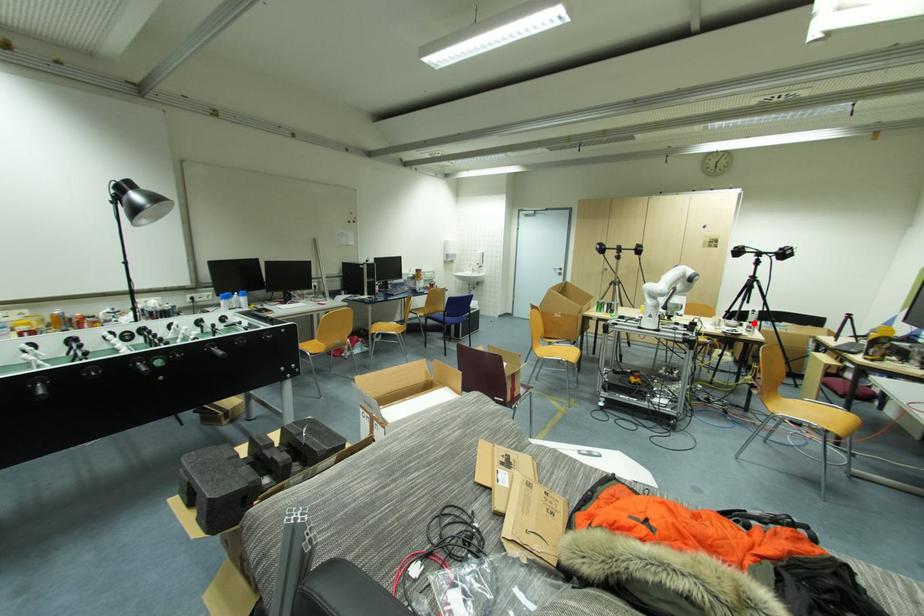
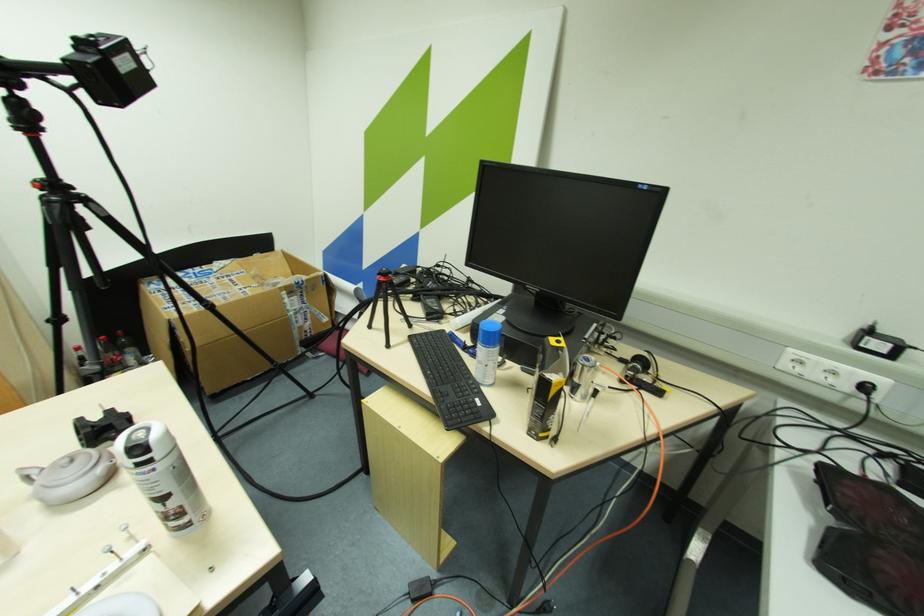
Find the pixel in the second image that matches the highlighted location in the first image.

(164, 500)